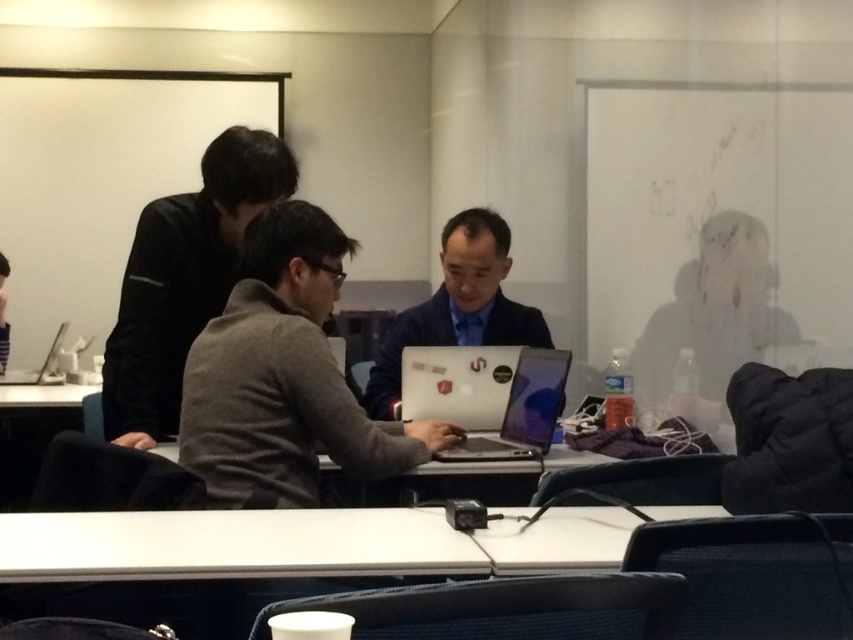
You are a photographer who needs to adjust the lighting for a photo shoot in the conference room. You have a matte black jacket at right and a camera. How far apart are these two items?

The matte black jacket at right and the camera are 2.45 meters apart from each other.

In the scene shown: You are organizing a meeting in the conference room and need to place a new document holder between the matte black jacket at right and the silver metallic laptop at lower left. Based on their positions, where should you place the document holder?

The document holder should be placed between the matte black jacket at right and the silver metallic laptop at lower left, positioned to the right of the laptop since the jacket is to the right of the laptop.